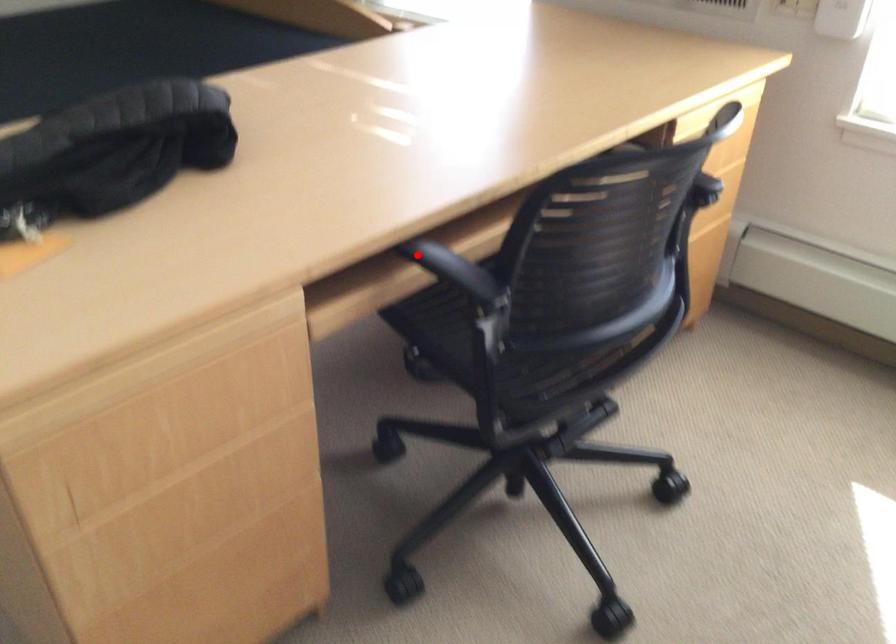
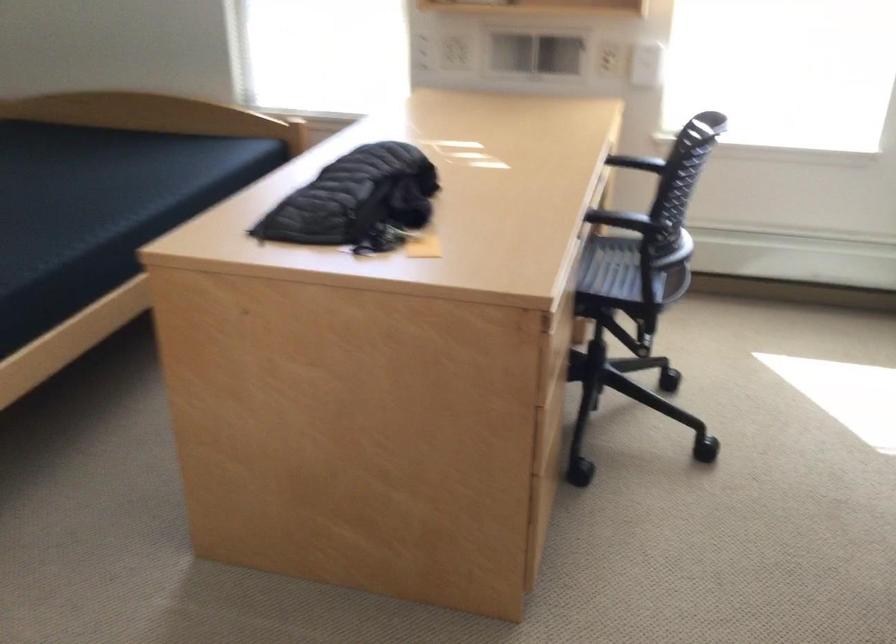
Question: I am providing you with two images of the same scene from different viewpoints. In image1, a red point is highlighted. Considering the same 3D point in image2, which of the following is correct?

Choices:
 (A) It is closer
 (B) It is farther

Answer: (B)